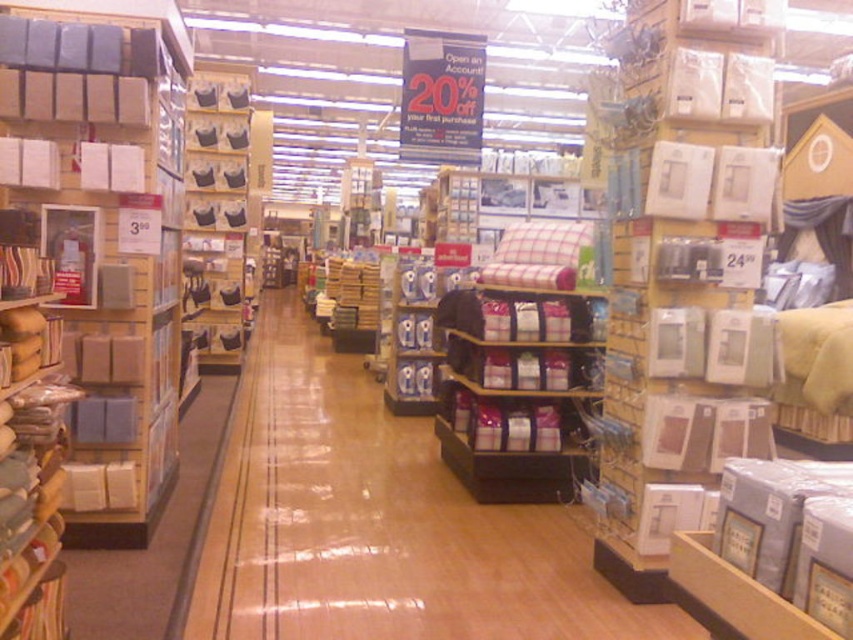
Find the location of a particular element. This screenshot has height=640, width=853. matte black pillow at center is located at coordinates (378, 524).